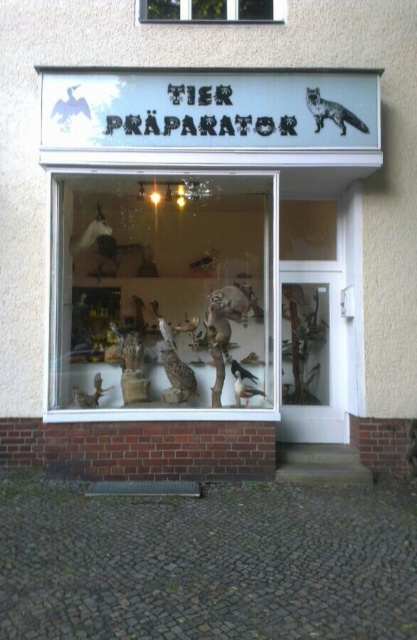
Is wooden display case at center positioned at the back of transparent glass window at upper center?

That is False.

How much distance is there between wooden display case at center and transparent glass window at upper center?

A distance of 8.44 feet exists between wooden display case at center and transparent glass window at upper center.

Measure the distance between point (170, 323) and camera.

Point (170, 323) and camera are 8.03 meters apart from each other.

The height and width of the screenshot is (640, 417). Identify the location of wooden display case at center. (156, 288).

Consider the image. Can you confirm if transparent glass window at upper center is wider than gray fur fox at upper right?

Yes.

Is point (160, 4) in front of point (336, 115)?

That is False.

Where is `transparent glass window at upper center`? The height and width of the screenshot is (640, 417). transparent glass window at upper center is located at coordinates (208, 10).

Based on the photo, is matte plastic animal figures at center wider than matte brown owl at center?

Correct, the width of matte plastic animal figures at center exceeds that of matte brown owl at center.

Measure the distance between matte plastic animal figures at center and camera.

They are 6.75 meters apart.

Is point (161, 93) more distant than point (173, 380)?

No, it is not.

The image size is (417, 640). In order to click on matte plastic animal figures at center in this screenshot , I will do `click(180, 225)`.